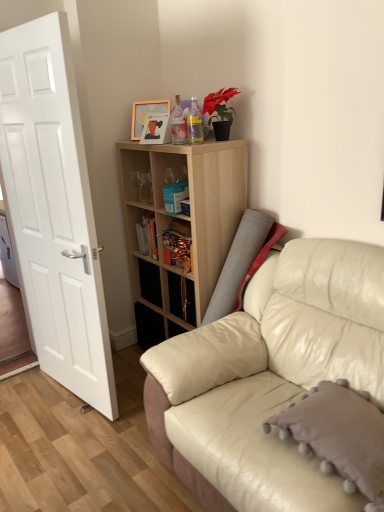
Question: Is leather couch at right positioned far away from blue matte bookshelf at center, the first book viewed from the right?

Choices:
 (A) no
 (B) yes

Answer: (A)

Question: From the image's perspective, would you say leather couch at right is positioned over blue matte bookshelf at center, marked as the first book in a front-to-back arrangement?

Choices:
 (A) no
 (B) yes

Answer: (A)

Question: Is leather couch at right turned away from blue matte bookshelf at center, positioned as the 2th book in back-to-front order?

Choices:
 (A) yes
 (B) no

Answer: (B)

Question: Is leather couch at right taller than blue matte bookshelf at center, positioned as the 2th book in back-to-front order?

Choices:
 (A) yes
 (B) no

Answer: (A)

Question: Considering the relative positions of leather couch at right and blue matte bookshelf at center, the first book viewed from the right, in the image provided, is leather couch at right to the right of blue matte bookshelf at center, the first book viewed from the right, from the viewer's perspective?

Choices:
 (A) no
 (B) yes

Answer: (B)

Question: Can you confirm if leather couch at right is bigger than blue matte bookshelf at center, positioned as the 2th book in back-to-front order?

Choices:
 (A) no
 (B) yes

Answer: (B)

Question: Is gray fluffy pillow at lower right looking in the opposite direction of translucent plastic bottle at upper center, which is the 2th bottle in right-to-left order?

Choices:
 (A) yes
 (B) no

Answer: (B)

Question: Does gray fluffy pillow at lower right contain translucent plastic bottle at upper center, the 1th bottle positioned from the left?

Choices:
 (A) yes
 (B) no

Answer: (B)

Question: From a real-world perspective, is gray fluffy pillow at lower right positioned over translucent plastic bottle at upper center, which is the 2th bottle in right-to-left order, based on gravity?

Choices:
 (A) no
 (B) yes

Answer: (A)

Question: From the image's perspective, is gray fluffy pillow at lower right on top of translucent plastic bottle at upper center, which is the 2th bottle in right-to-left order?

Choices:
 (A) no
 (B) yes

Answer: (A)

Question: Can you confirm if gray fluffy pillow at lower right is positioned to the left of translucent plastic bottle at upper center, which is the 2th bottle in right-to-left order?

Choices:
 (A) no
 (B) yes

Answer: (A)

Question: Can you confirm if gray fluffy pillow at lower right is thinner than translucent plastic bottle at upper center, which is the 2th bottle in right-to-left order?

Choices:
 (A) yes
 (B) no

Answer: (B)

Question: Is hardcover book at center, which is counted as the 1th book, starting from the left, beside leather couch at right?

Choices:
 (A) yes
 (B) no

Answer: (B)